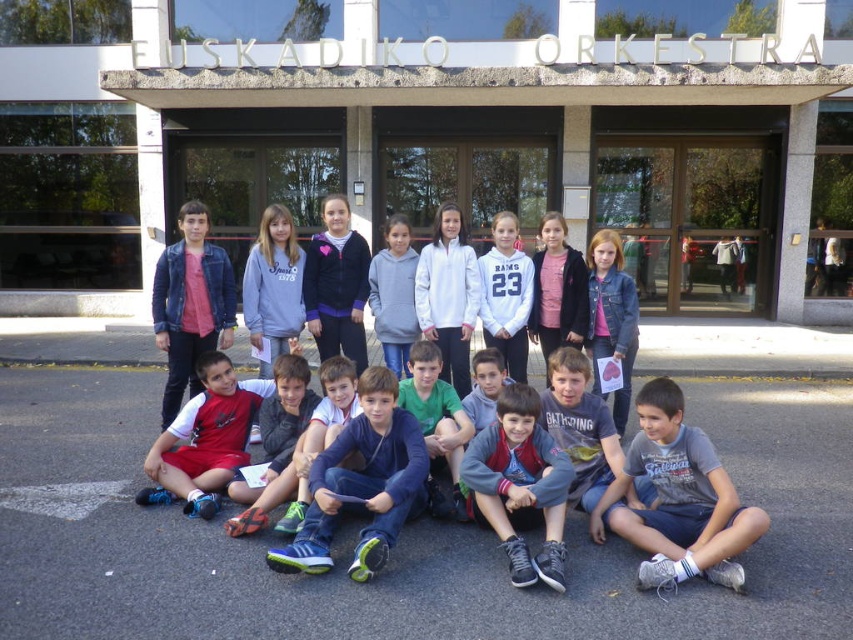
Is matte gray hoodie at center positioned behind gray fleece sweatshirt at center?

No, matte gray hoodie at center is closer to the viewer.

Does point (648, 563) lie behind point (287, 260)?

No, (648, 563) is closer to viewer.

This screenshot has height=640, width=853. What are the coordinates of `matte gray hoodie at center` in the screenshot? It's located at (608, 481).

Does gray fleece sweatshirt at center have a larger size compared to pink fleece jacket at center?

No, gray fleece sweatshirt at center is not bigger than pink fleece jacket at center.

Who is shorter, gray fleece sweatshirt at center or pink fleece jacket at center?

pink fleece jacket at center

Where is `gray fleece sweatshirt at center`? The image size is (853, 640). gray fleece sweatshirt at center is located at coordinates (273, 285).

Can you confirm if gray cotton shirt at lower right is smaller than gray fleece sweatshirt at center?

Actually, gray cotton shirt at lower right might be larger than gray fleece sweatshirt at center.

Does gray cotton shirt at lower right appear on the left side of gray fleece sweatshirt at center?

In fact, gray cotton shirt at lower right is to the right of gray fleece sweatshirt at center.

The width and height of the screenshot is (853, 640). In order to click on gray cotton shirt at lower right in this screenshot , I will do `click(680, 493)`.

Where is `gray cotton shirt at lower right`? This screenshot has width=853, height=640. gray cotton shirt at lower right is located at coordinates (680, 493).